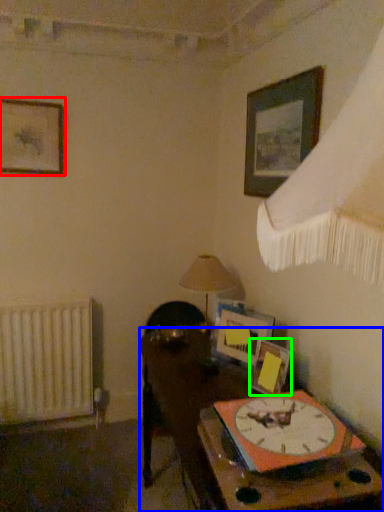
Question: Considering the real-world distances, which object is farthest from picture frame (highlighted by a red box)? table (highlighted by a blue box) or picture frame (highlighted by a green box)?

Choices:
 (A) table
 (B) picture frame

Answer: (B)